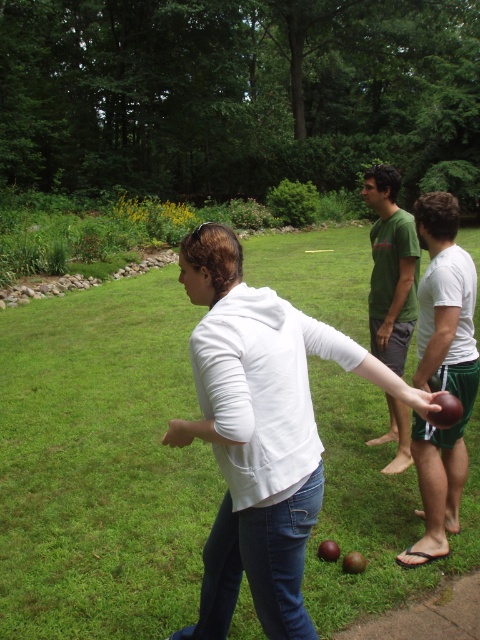
Question: Which point is farther to the camera?

Choices:
 (A) matte brown ball at right
 (B) green grass at center
 (C) green t-shirt at center

Answer: (C)

Question: Which object appears closest to the camera in this image?

Choices:
 (A) green grass at center
 (B) matte brown ball at right
 (C) green t-shirt at center

Answer: (A)

Question: Is green grass at center positioned behind matte brown ball at right?

Choices:
 (A) yes
 (B) no

Answer: (B)

Question: Which object is farther from the camera taking this photo?

Choices:
 (A) green t-shirt at center
 (B) matte brown ball at right
 (C) green grass at center

Answer: (A)

Question: Does green grass at center have a greater width compared to matte brown ball at right?

Choices:
 (A) no
 (B) yes

Answer: (B)

Question: Can you confirm if matte brown ball at right is positioned above green t-shirt at center?

Choices:
 (A) no
 (B) yes

Answer: (A)